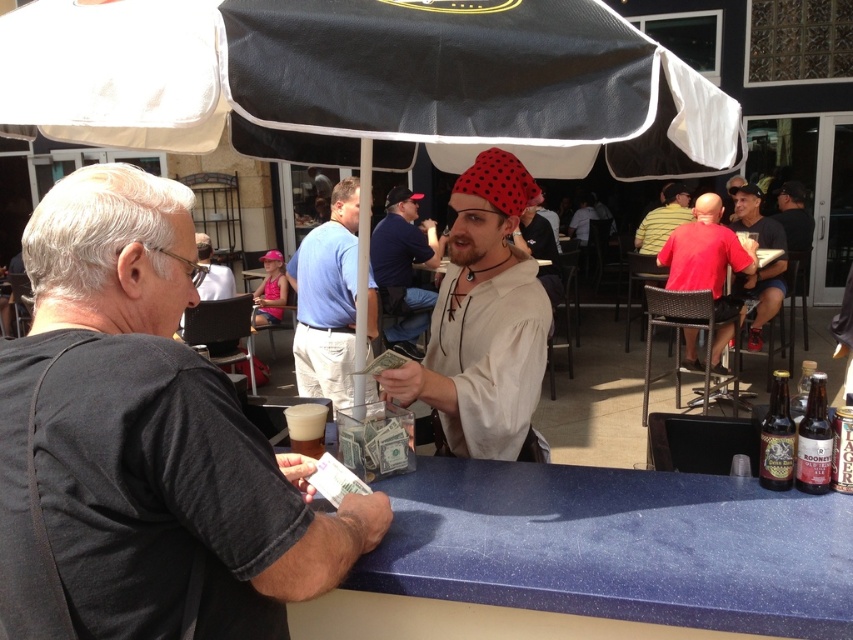
Does blue cotton shirt at center have a greater height compared to matte black shirt at right?

In fact, blue cotton shirt at center may be shorter than matte black shirt at right.

Which is more to the right, blue cotton shirt at center or matte black shirt at right?

From the viewer's perspective, matte black shirt at right appears more on the right side.

Between point (318, 259) and point (782, 292), which one is positioned in front?

Point (318, 259)

Where is `blue cotton shirt at center`? This screenshot has width=853, height=640. blue cotton shirt at center is located at coordinates (328, 300).

Is blue cotton shirt at center positioned behind yellow striped shirt at upper center?

No, it is not.

Is point (309, 314) in front of point (682, 195)?

That is True.

Which is behind, point (341, 182) or point (664, 216)?

Positioned behind is point (664, 216).

At what (x,y) coordinates should I click in order to perform the action: click on blue cotton shirt at center. Please return your answer as a coordinate pair (x, y). The width and height of the screenshot is (853, 640). Looking at the image, I should click on (328, 300).

Image resolution: width=853 pixels, height=640 pixels. What do you see at coordinates (708, 264) in the screenshot?
I see `red cotton shirt at right` at bounding box center [708, 264].

Can you confirm if red cotton shirt at right is positioned above brown glass bottle at right?

Correct, red cotton shirt at right is located above brown glass bottle at right.

Is point (685, 364) closer to camera compared to point (825, 481)?

No.

At what (x,y) coordinates should I click in order to perform the action: click on red cotton shirt at right. Please return your answer as a coordinate pair (x, y). This screenshot has height=640, width=853. Looking at the image, I should click on (708, 264).